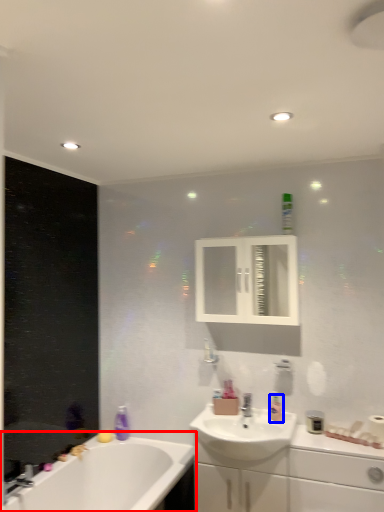
Question: Which of the following is the closest to the observer, bathtub (highlighted by a red box) or toiletry (highlighted by a blue box)?

Choices:
 (A) bathtub
 (B) toiletry

Answer: (A)